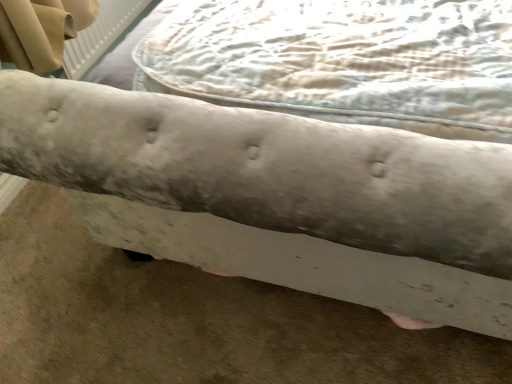
Question: From the image's perspective, is light beige textured mattress at center located above or below frosted glass bench at center?

Choices:
 (A) below
 (B) above

Answer: (A)

Question: Is light beige textured mattress at center situated inside frosted glass bench at center or outside?

Choices:
 (A) inside
 (B) outside

Answer: (A)

Question: Visually, is light beige textured mattress at center positioned to the left or to the right of frosted glass bench at center?

Choices:
 (A) left
 (B) right

Answer: (A)

Question: Is frosted glass bench at center inside the boundaries of light beige textured mattress at center, or outside?

Choices:
 (A) outside
 (B) inside

Answer: (A)

Question: Considering the positions of frosted glass bench at center and light beige textured mattress at center in the image, is frosted glass bench at center taller or shorter than light beige textured mattress at center?

Choices:
 (A) short
 (B) tall

Answer: (B)

Question: Is frosted glass bench at center wider or thinner than light beige textured mattress at center?

Choices:
 (A) thin
 (B) wide

Answer: (B)

Question: Visually, is frosted glass bench at center positioned to the left or to the right of light beige textured mattress at center?

Choices:
 (A) right
 (B) left

Answer: (A)